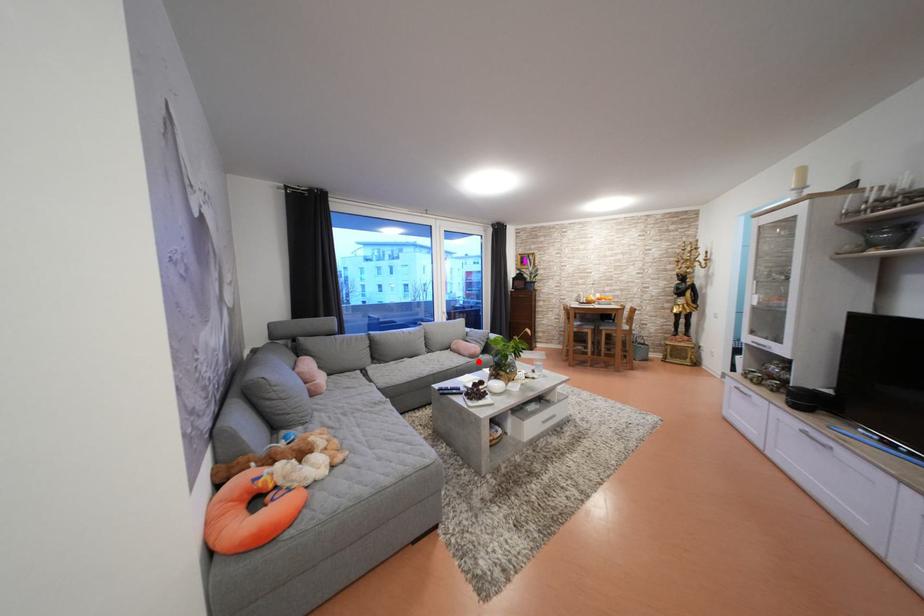
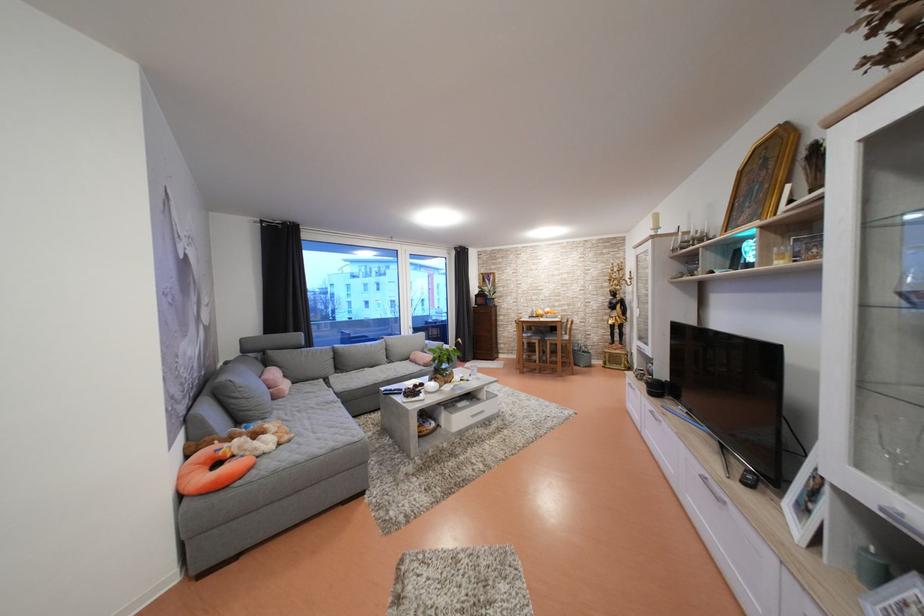
Question: I am providing you with two images of the same scene from different viewpoints. Given a red point in image1, look at the same physical point in image2. Is it:

Choices:
 (A) Closer to the viewpoint
 (B) Farther from the viewpoint

Answer: (B)